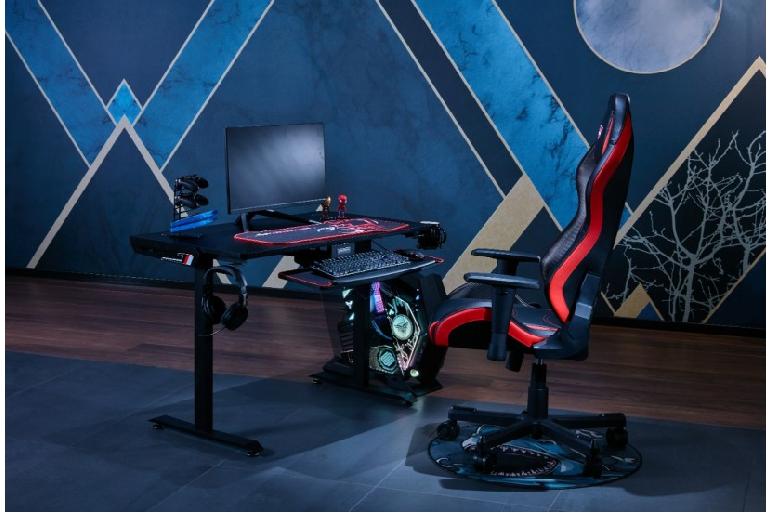
Where is `tree painted on the wall in the background`? tree painted on the wall in the background is located at coordinates (693, 259).